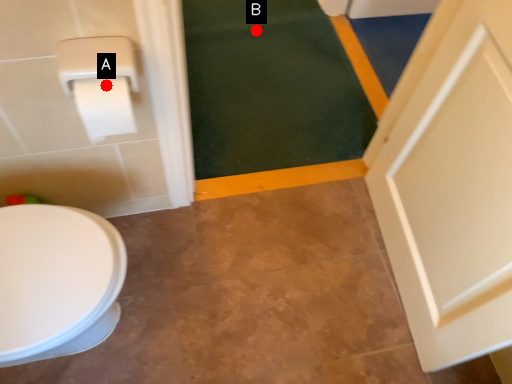
Question: Two points are circled on the image, labeled by A and B beside each circle. Among these points, which one is nearest to the camera?

Choices:
 (A) A is closer
 (B) B is closer

Answer: (A)